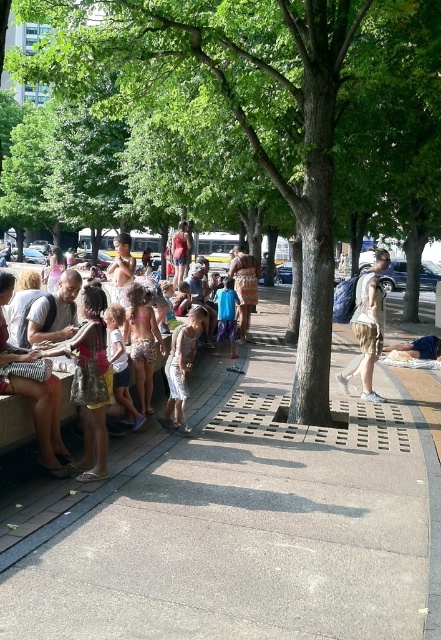
You are a maintenance worker who needs to water the green leafy tree at center. You have a hose that can reach up to 30 feet. You are currently standing on the concrete at center. Can you water the tree without moving your position?

The concrete at center and green leafy tree at center are 31.50 feet apart from each other. Since the hose can only reach up to 30 feet, you cannot water the tree without moving your position.

You are a photographer trying to capture a clear photo of the light brown fabric backpack at center without the patterned fabric dress at center blocking it. Based on the scene description, can you position yourself in a way to achieve this?

Yes, since the light brown fabric backpack at center is in front of the patterned fabric dress at center, positioning yourself behind the backpack will allow you to capture it without the dress obstructing the view.

You are standing in the park and want to walk from point A to point B. Point A is at coordinate point (x=246, y=388) and point B is at coordinate point (x=385, y=67). Since you want to take the shortest path, which direction should you head towards?

Since point (x=246, y=388) is further to the viewer than point (x=385, y=67), you should head towards the direction away from you to reach point (x=385, y=67) from point (x=246, y=388).